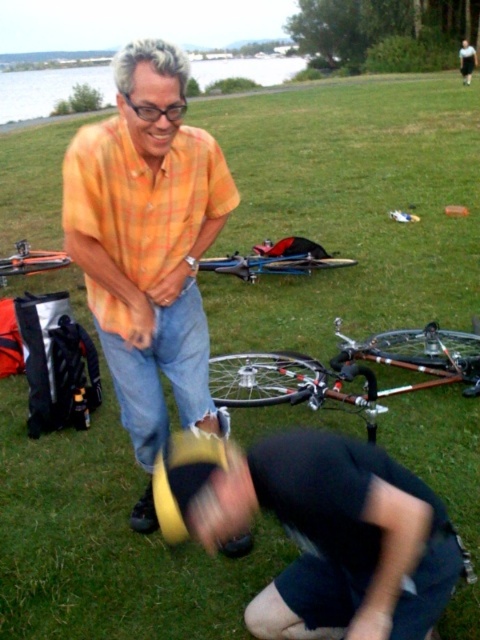
Question: Does dark gray fabric squat at lower center have a greater width compared to brushed metal bicycle at center?

Choices:
 (A) yes
 (B) no

Answer: (A)

Question: Which point is farther to the camera?

Choices:
 (A) dark gray fabric squat at lower center
 (B) orange plaid shirt at center
 (C) brushed metal bicycle at center

Answer: (C)

Question: Can you confirm if orange plaid shirt at center is bigger than brushed metal bicycle at center?

Choices:
 (A) yes
 (B) no

Answer: (A)

Question: Considering the real-world distances, which object is closest to the orange plaid shirt at center?

Choices:
 (A) brushed metal bicycle at center
 (B) silver metallic bicycle at center
 (C) dark gray fabric squat at lower center

Answer: (C)

Question: Is dark gray fabric squat at lower center further to camera compared to brushed metal bicycle at center?

Choices:
 (A) no
 (B) yes

Answer: (A)

Question: Which of the following is the farthest from the observer?

Choices:
 (A) (13, 257)
 (B) (108, 358)
 (C) (253, 400)

Answer: (A)